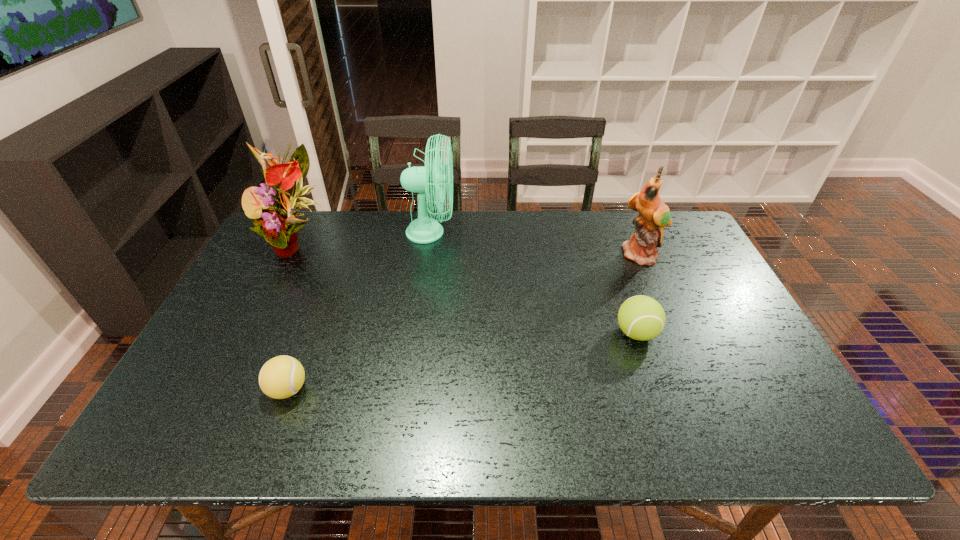
You are a GUI agent. You are given a task and a screenshot of the screen. Output one action in this format:
    pyautogui.click(x=<x>, y=<y>)
    Task: Click on the vacant area situated 0.240m on the front of the fourth tallest object
    The width and height of the screenshot is (960, 540).
    Given the screenshot: What is the action you would take?
    pyautogui.click(x=673, y=441)

At what (x,y) coordinates should I click in order to perform the action: click on vacant area situated on the back of the shortest object. Please return your answer as a coordinate pair (x, y). Looking at the image, I should click on (311, 328).

I want to click on fan positioned at the far edge, so click(x=423, y=230).

What are the coordinates of `bouquet situated at the far edge` in the screenshot? It's located at (277, 224).

The height and width of the screenshot is (540, 960). I want to click on parrot that is at the far edge, so click(x=654, y=214).

This screenshot has height=540, width=960. What are the coordinates of `object positioned at the left edge` in the screenshot? It's located at (277, 224).

Where is `object positioned at the right edge`? object positioned at the right edge is located at coordinates (654, 214).

The height and width of the screenshot is (540, 960). I want to click on object located in the far left corner section of the desktop, so click(277, 224).

Locate an element on the screen. The height and width of the screenshot is (540, 960). object that is at the far right corner is located at coordinates (654, 214).

Locate an element on the screen. This screenshot has width=960, height=540. free region at the far edge of the desktop is located at coordinates (425, 244).